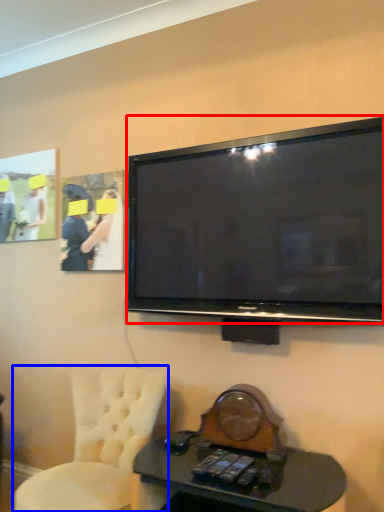
Question: Which point is closer to the camera, television (highlighted by a red box) or chair (highlighted by a blue box)?

Choices:
 (A) television
 (B) chair

Answer: (B)